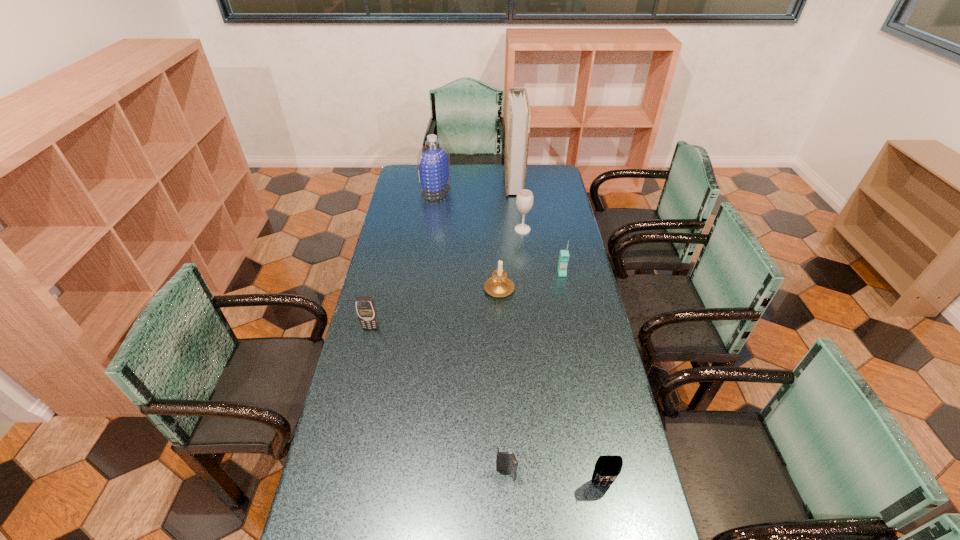
You are a GUI agent. You are given a task and a screenshot of the screen. Output one action in this format:
    pyautogui.click(x=<x>, y=<y>)
    Task: Click on the fourth closest cellular telephone relative to the tallest object
    The image size is (960, 540).
    Given the screenshot: What is the action you would take?
    pyautogui.click(x=607, y=468)

Where is `cellular telephone identified as the third closest to the candle holder`? cellular telephone identified as the third closest to the candle holder is located at coordinates (504, 461).

Identify the location of vacant space that satisfies the following two spatial constraints: 1. with a handle on the side of the candle holder; 2. on the right side of the wineglass. (496, 230).

This screenshot has height=540, width=960. I want to click on vacant space that satisfies the following two spatial constraints: 1. on the front side of the cleansing agent; 2. on the right side of the sixth shortest object, so click(431, 230).